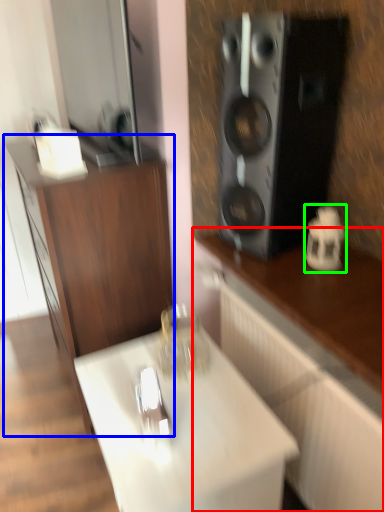
Question: Which is farther away from cabinetry (highlighted by a red box)? cabinetry (highlighted by a blue box) or appliance (highlighted by a green box)?

Choices:
 (A) cabinetry
 (B) appliance

Answer: (A)